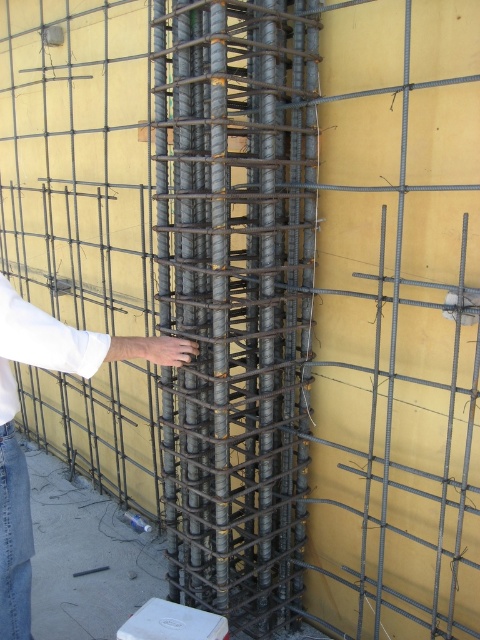
Question: Can you confirm if gray metallic rebar at center is positioned below white fabric hand at center?

Choices:
 (A) no
 (B) yes

Answer: (A)

Question: Estimate the real-world distances between objects in this image. Which object is closer to the white fabric hand at center?

Choices:
 (A) gray metallic rebar at center
 (B) white cotton shirt at center

Answer: (B)

Question: Can you confirm if gray metallic rebar at center is thinner than white fabric hand at center?

Choices:
 (A) no
 (B) yes

Answer: (B)

Question: Is gray metallic rebar at center to the right of white cotton shirt at center from the viewer's perspective?

Choices:
 (A) no
 (B) yes

Answer: (B)

Question: Which object appears farthest from the camera in this image?

Choices:
 (A) white cotton shirt at center
 (B) white fabric hand at center

Answer: (B)

Question: Among these points, which one is nearest to the camera?

Choices:
 (A) (15, 342)
 (B) (160, 76)

Answer: (A)